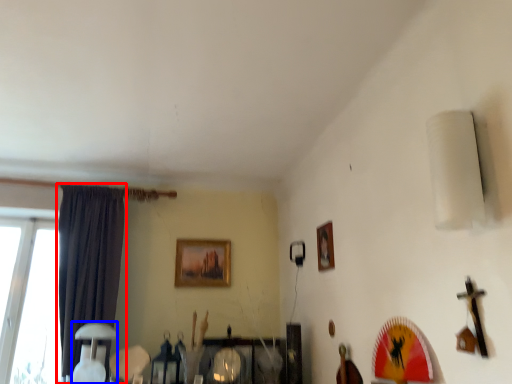
Question: Which object appears farthest to the camera in this image, curtain (highlighted by a red box) or table lamp (highlighted by a blue box)?

Choices:
 (A) curtain
 (B) table lamp

Answer: (A)